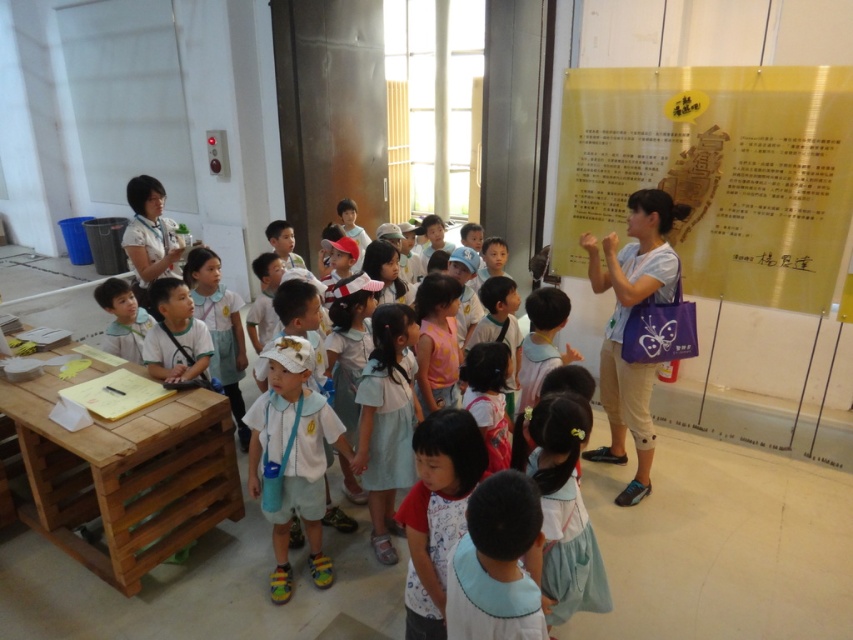
Which is more to the left, white matte shirt at center or white matte hat at center?

From the viewer's perspective, white matte shirt at center appears more on the left side.

Find the location of a particular element. This screenshot has height=640, width=853. white matte shirt at center is located at coordinates (264, 586).

Does point (612, 339) come closer to viewer compared to point (396, 448)?

No, it is behind (396, 448).

Does purple fabric bag at center have a smaller size compared to white cotton dress at center?

No, purple fabric bag at center is not smaller than white cotton dress at center.

Describe the element at coordinates (625, 323) in the screenshot. Image resolution: width=853 pixels, height=640 pixels. I see `purple fabric bag at center` at that location.

You are a GUI agent. You are given a task and a screenshot of the screen. Output one action in this format:
    pyautogui.click(x=<x>, y=<y>)
    Task: Click on the purple fabric bag at center
    This screenshot has width=853, height=640.
    Given the screenshot: What is the action you would take?
    pyautogui.click(x=625, y=323)

Is point (262, 435) farther from camera compared to point (373, 310)?

No, it is in front of (373, 310).

Does point (312, 525) come closer to viewer compared to point (358, 460)?

No, (312, 525) is further to viewer.

Find the location of a particular element. This screenshot has width=853, height=640. white matte hat at center is located at coordinates (292, 458).